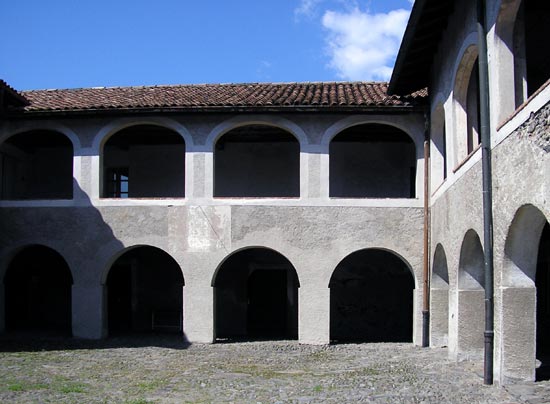
This screenshot has height=404, width=550. In order to click on circle door way in this screenshot , I will do `click(361, 257)`, `click(277, 291)`, `click(117, 287)`, `click(25, 287)`.